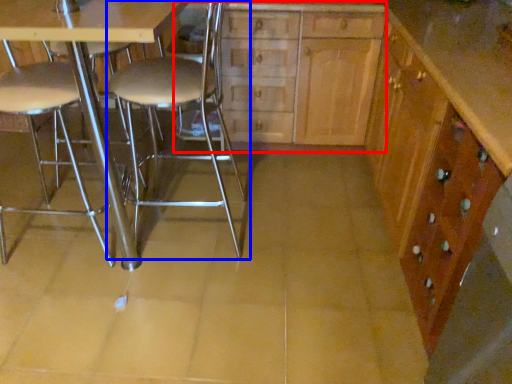
Question: Which of the following is the closest to the observer, dresser (highlighted by a red box) or chair (highlighted by a blue box)?

Choices:
 (A) dresser
 (B) chair

Answer: (B)